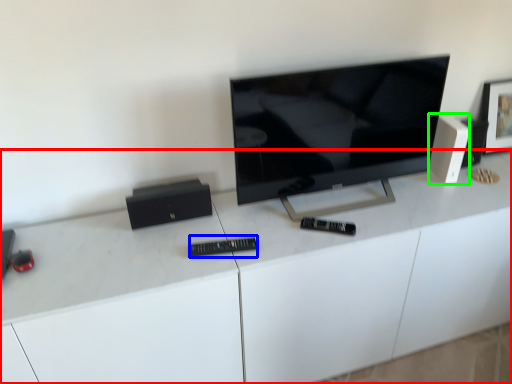
Question: Considering the real-world distances, which object is farthest from desk (highlighted by a red box)? control (highlighted by a blue box) or speaker (highlighted by a green box)?

Choices:
 (A) control
 (B) speaker

Answer: (B)